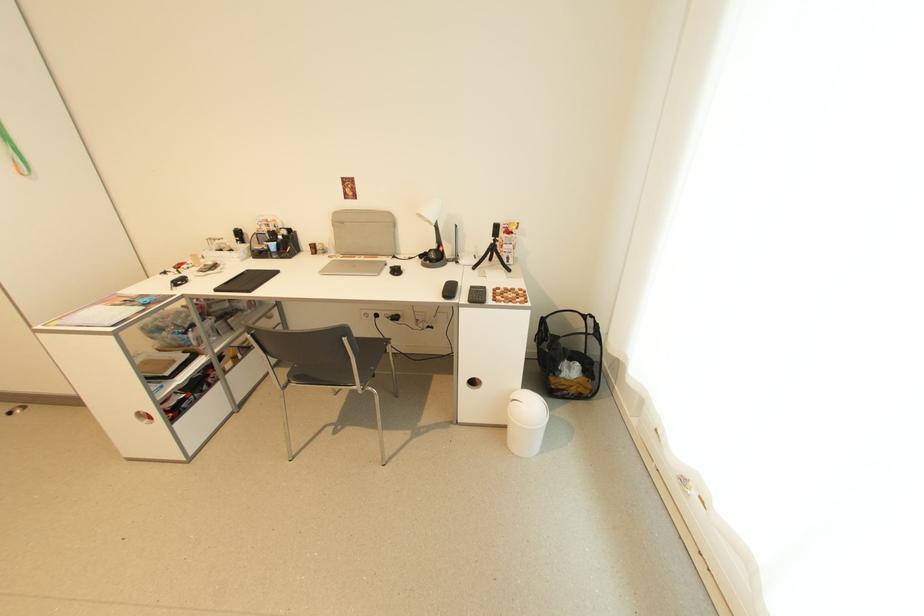
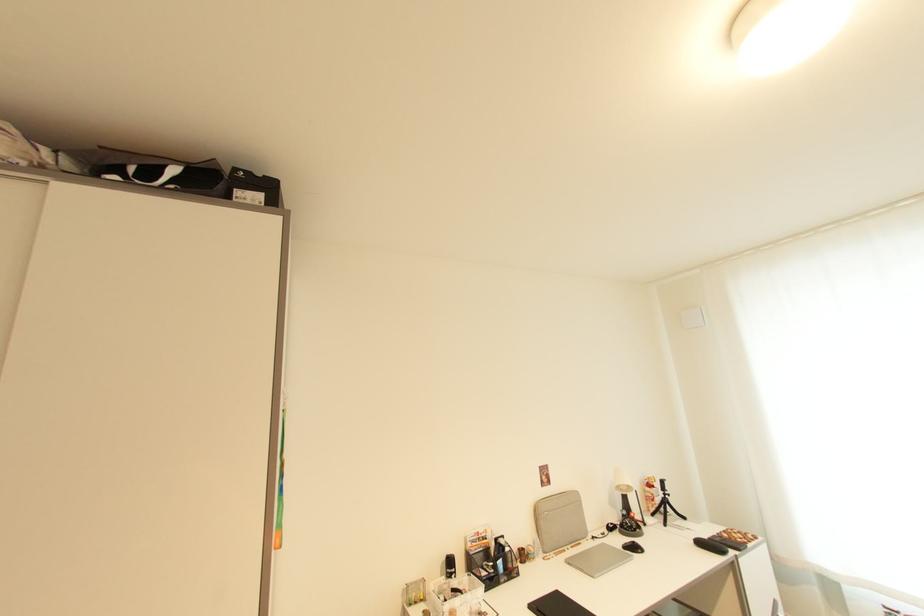
In the second image, find the point that corresponds to pixel 497 244 in the first image.

(669, 498)